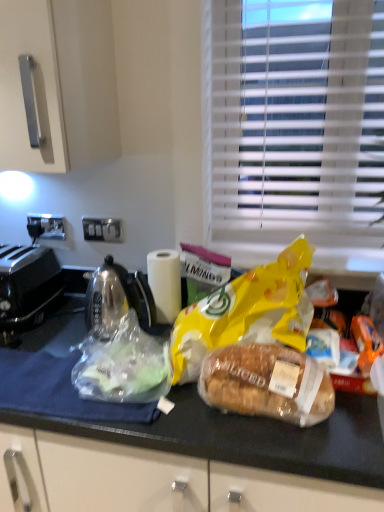
Question: Can you confirm if translucent plastic bag at center is thinner than translucent plastic bread at center?

Choices:
 (A) yes
 (B) no

Answer: (B)

Question: Is translucent plastic bag at center positioned with its back to translucent plastic bread at center?

Choices:
 (A) yes
 (B) no

Answer: (B)

Question: Considering the relative sizes of translucent plastic bag at center and translucent plastic bread at center in the image provided, is translucent plastic bag at center taller than translucent plastic bread at center?

Choices:
 (A) yes
 (B) no

Answer: (B)

Question: Considering the relative sizes of translucent plastic bag at center and translucent plastic bread at center in the image provided, is translucent plastic bag at center bigger than translucent plastic bread at center?

Choices:
 (A) no
 (B) yes

Answer: (A)

Question: Are translucent plastic bag at center and translucent plastic bread at center far apart?

Choices:
 (A) no
 (B) yes

Answer: (A)

Question: From a real-world perspective, is translucent plastic bag at center located beneath translucent plastic bread at center?

Choices:
 (A) no
 (B) yes

Answer: (B)

Question: Could you tell me if white plastic blinds at upper right is turned towards translucent plastic bread at center?

Choices:
 (A) yes
 (B) no

Answer: (A)

Question: Does white plastic blinds at upper right lie behind translucent plastic bread at center?

Choices:
 (A) no
 (B) yes

Answer: (B)

Question: Can you confirm if white plastic blinds at upper right is shorter than translucent plastic bread at center?

Choices:
 (A) no
 (B) yes

Answer: (A)

Question: Is white plastic blinds at upper right closer to the viewer compared to translucent plastic bread at center?

Choices:
 (A) no
 (B) yes

Answer: (A)

Question: From the image's perspective, is white plastic blinds at upper right beneath translucent plastic bread at center?

Choices:
 (A) yes
 (B) no

Answer: (B)

Question: Can you confirm if white plastic blinds at upper right is thinner than translucent plastic bread at center?

Choices:
 (A) no
 (B) yes

Answer: (B)

Question: Is yellow matte plastic bag at center, marked as the second plastic bag in a left-to-right arrangement, outside of translucent plastic bag at center, which is the 1th plastic bag in left-to-right order?

Choices:
 (A) no
 (B) yes

Answer: (B)